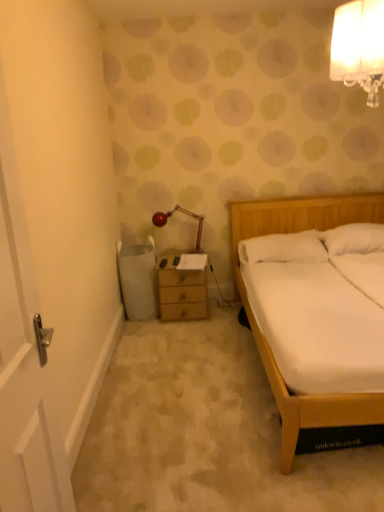
Question: From a real-world perspective, does white glass lampshade at upper right, which is counted as the 2th lamp, starting from the bottom, sit lower than white soft pillow at right, marked as the 1th pillow in a left-to-right arrangement?

Choices:
 (A) no
 (B) yes

Answer: (A)

Question: Does white glass lampshade at upper right, marked as the second lamp in a back-to-front arrangement, lie behind white soft pillow at right, marked as the 1th pillow in a left-to-right arrangement?

Choices:
 (A) yes
 (B) no

Answer: (B)

Question: Is white glass lampshade at upper right, placed as the first lamp when sorted from top to bottom, positioned in front of white soft pillow at right, marked as the 1th pillow in a left-to-right arrangement?

Choices:
 (A) yes
 (B) no

Answer: (A)

Question: Is white glass lampshade at upper right, which is the 1th lamp from front to back, looking in the opposite direction of white soft pillow at right, marked as the 1th pillow in a left-to-right arrangement?

Choices:
 (A) yes
 (B) no

Answer: (B)

Question: From a real-world perspective, is white glass lampshade at upper right, placed as the first lamp when sorted from top to bottom, on top of white soft pillow at right, marked as the 1th pillow in a left-to-right arrangement?

Choices:
 (A) no
 (B) yes

Answer: (B)

Question: From a real-world perspective, is wooden chest of drawers at center physically located above or below white wooden door at left?

Choices:
 (A) above
 (B) below

Answer: (B)

Question: Looking at the image, does wooden chest of drawers at center seem bigger or smaller compared to white wooden door at left?

Choices:
 (A) small
 (B) big

Answer: (B)

Question: Relative to white wooden door at left, is wooden chest of drawers at center in front or behind?

Choices:
 (A) front
 (B) behind

Answer: (B)

Question: From their relative heights in the image, would you say wooden chest of drawers at center is taller or shorter than white wooden door at left?

Choices:
 (A) short
 (B) tall

Answer: (A)

Question: In the image, is white soft pillow at upper right, the 2th pillow when ordered from left to right, positioned in front of or behind white soft pillow at right, marked as the 1th pillow in a left-to-right arrangement?

Choices:
 (A) front
 (B) behind

Answer: (B)

Question: Is white soft pillow at upper right, arranged as the 1th pillow when viewed from the right, wider or thinner than white soft pillow at right, marked as the 1th pillow in a left-to-right arrangement?

Choices:
 (A) wide
 (B) thin

Answer: (B)

Question: Is point (372, 238) closer or farther from the camera than point (264, 247)?

Choices:
 (A) farther
 (B) closer

Answer: (B)

Question: From a real-world perspective, is white soft pillow at upper right, the 2th pillow when ordered from left to right, positioned above or below white soft pillow at right, which ranks as the second pillow in right-to-left order?

Choices:
 (A) above
 (B) below

Answer: (A)

Question: Considering the positions of white soft pillow at right, marked as the 1th pillow in a left-to-right arrangement, and white glass lampshade at upper right, acting as the 2th lamp starting from the left, in the image, is white soft pillow at right, marked as the 1th pillow in a left-to-right arrangement, wider or thinner than white glass lampshade at upper right, acting as the 2th lamp starting from the left,?

Choices:
 (A) thin
 (B) wide

Answer: (B)

Question: From the image's perspective, is white soft pillow at right, marked as the 1th pillow in a left-to-right arrangement, positioned above or below white glass lampshade at upper right, marked as the second lamp in a back-to-front arrangement?

Choices:
 (A) above
 (B) below

Answer: (B)